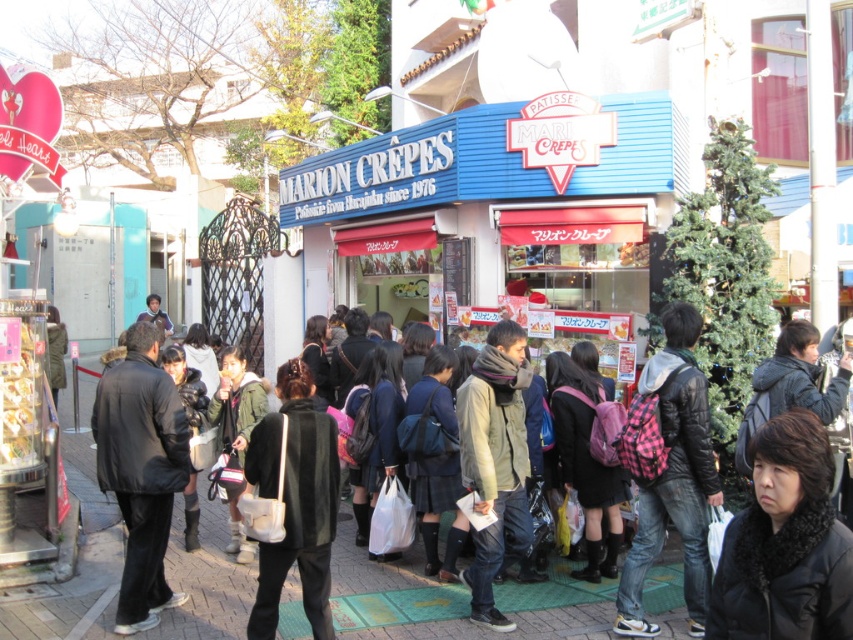
You are a photographer trying to capture a photo of the crowd in front of Marion Cr?pes. You notice two jackets in the crowd, the black leather jacket at left and the khaki fabric jacket at center. Which jacket should you focus on to ensure it appears larger in your photo?

The black leather jacket at left is bigger than the khaki fabric jacket at center, so focusing on the black leather jacket at left will make it appear larger in the photo.

You are a delivery person trying to navigate through the crowd in front of Marion Cr?pes. You need to reach the entrance where the small Christmas tree is located. Which obstacle should you move around first, the dark gray jacket at center or the pink plaid backpack at center, based on their size?

The dark gray jacket at center occupies less space than the pink plaid backpack at center, so you should move around the pink plaid backpack at center first since it is larger and might block your path more.